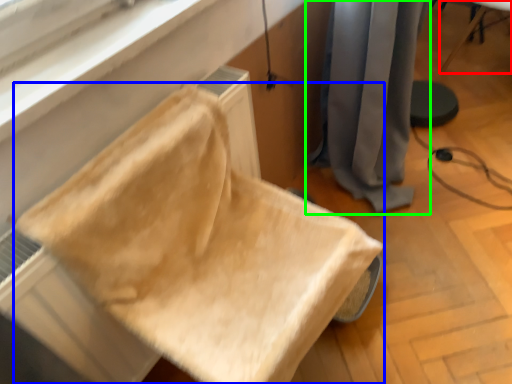
Question: Which object is the closest to the furniture (highlighted by a red box)? Choose among these: furniture (highlighted by a blue box) or curtain (highlighted by a green box).

Choices:
 (A) furniture
 (B) curtain

Answer: (B)